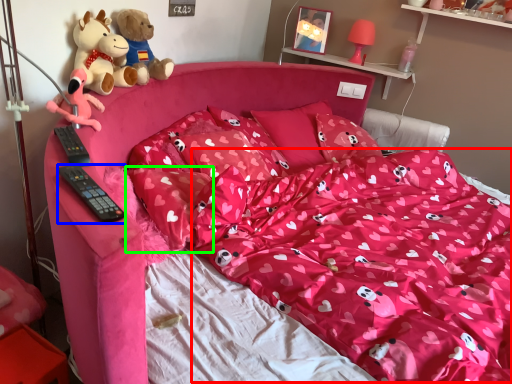
Question: Which is nearer to the blanket (highlighted by a red box)? remote control (highlighted by a blue box) or pillow (highlighted by a green box).

Choices:
 (A) remote control
 (B) pillow

Answer: (B)